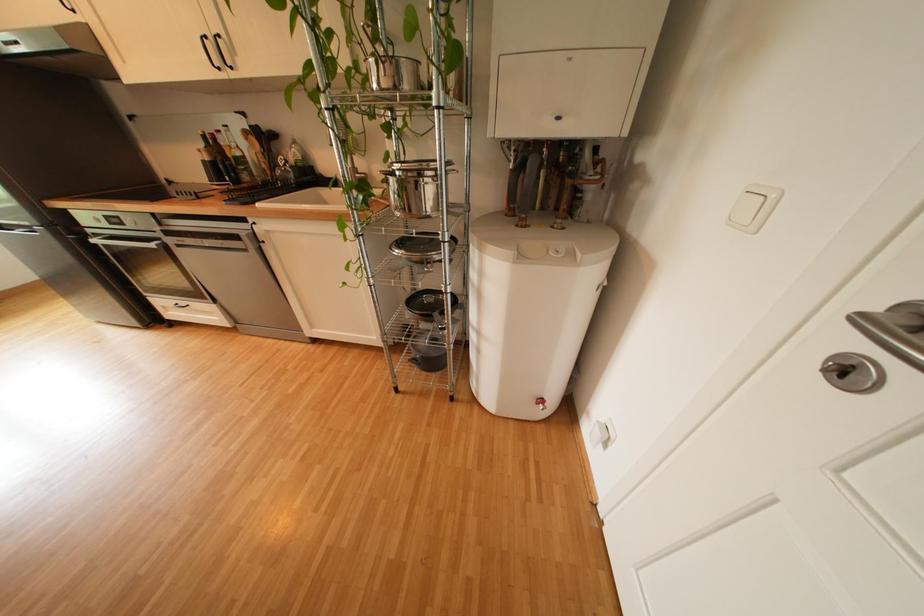
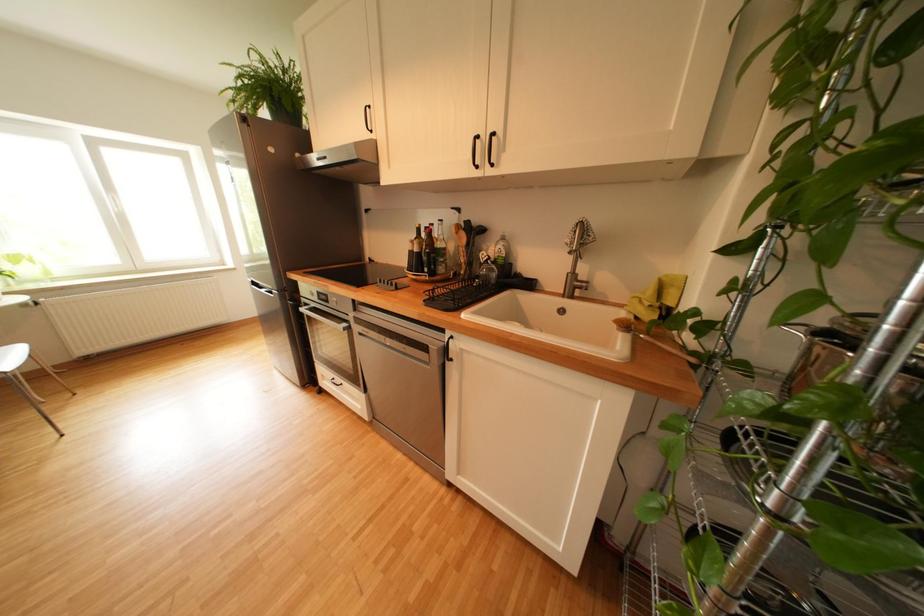
Which direction would the cameraman need to move to produce the second image?

The cameraman moved toward left, forward.